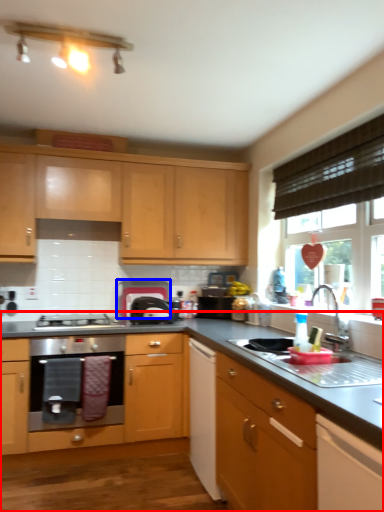
Question: Which object appears closest to the camera in this image, countertop (highlighted by a red box) or appliance (highlighted by a blue box)?

Choices:
 (A) countertop
 (B) appliance

Answer: (A)